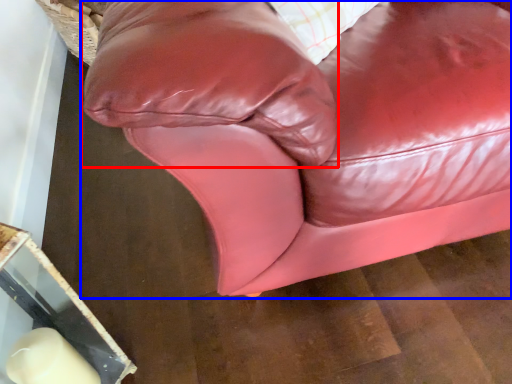
Question: Which of the following is the closest to the observer, pillow (highlighted by a red box) or studio couch (highlighted by a blue box)?

Choices:
 (A) pillow
 (B) studio couch

Answer: (A)